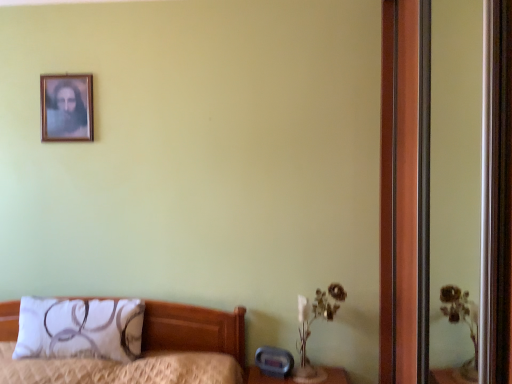
Question: Would you say wooden picture frame at upper left is to the left or to the right of wooden screen door at right in the picture?

Choices:
 (A) right
 (B) left

Answer: (B)

Question: Is wooden picture frame at upper left wider or thinner than wooden screen door at right?

Choices:
 (A) thin
 (B) wide

Answer: (A)

Question: Which object is the farthest from the wooden picture frame at upper left?

Choices:
 (A) wooden screen door at right
 (B) white fabric pillow at lower left

Answer: (A)

Question: Estimate the real-world distances between objects in this image. Which object is farther from the white fabric pillow at lower left?

Choices:
 (A) wooden picture frame at upper left
 (B) wooden screen door at right

Answer: (B)